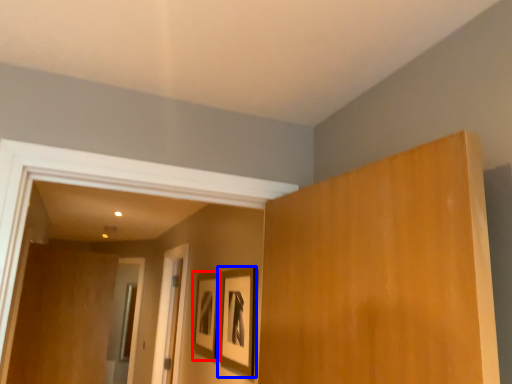
Question: Which object is further to the camera taking this photo, picture frame (highlighted by a red box) or picture frame (highlighted by a blue box)?

Choices:
 (A) picture frame
 (B) picture frame

Answer: (A)